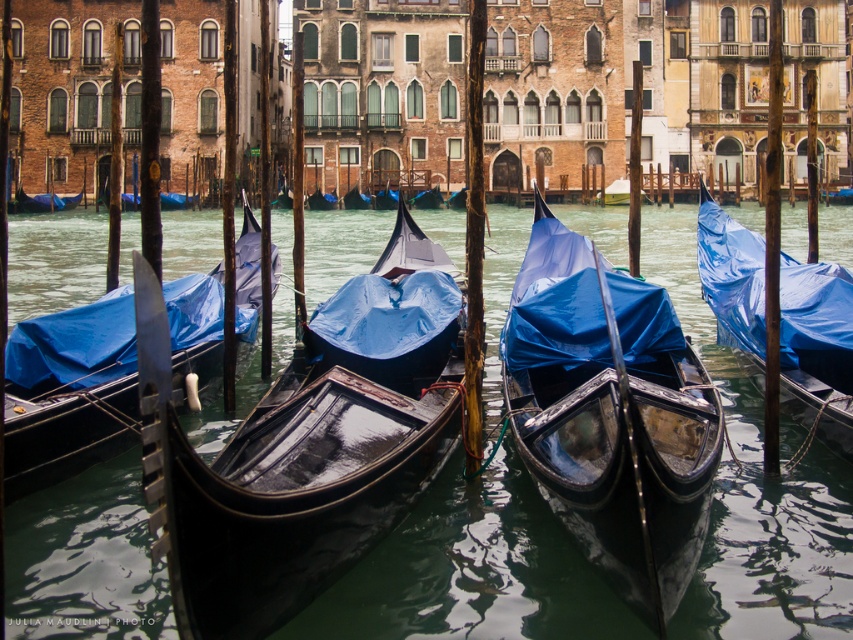
Question: Does shiny black canoe at center have a smaller size compared to blue tarpaulin gondola at center?

Choices:
 (A) yes
 (B) no

Answer: (B)

Question: Which point is farther to the camera?

Choices:
 (A) (363, 237)
 (B) (30, 436)
 (C) (786, 282)
 (D) (558, 380)

Answer: (A)

Question: Does shiny black canoe at center appear on the left side of blue tarpaulin gondola at center?

Choices:
 (A) no
 (B) yes

Answer: (B)

Question: Based on their relative distances, which object is farther from the shiny black gondola at center?

Choices:
 (A) glossy black gondolas at center
 (B) shiny black canoe at center
 (C) blue tarpaulin gondola at center

Answer: (B)

Question: Which of these objects is positioned closest to the shiny black gondola at center?

Choices:
 (A) glossy black gondolas at center
 (B) shiny black canoe at center
 (C) blue tarpaulin gondola at center

Answer: (A)

Question: Does shiny black gondola at center appear over blue tarpaulin gondola at center?

Choices:
 (A) no
 (B) yes

Answer: (A)